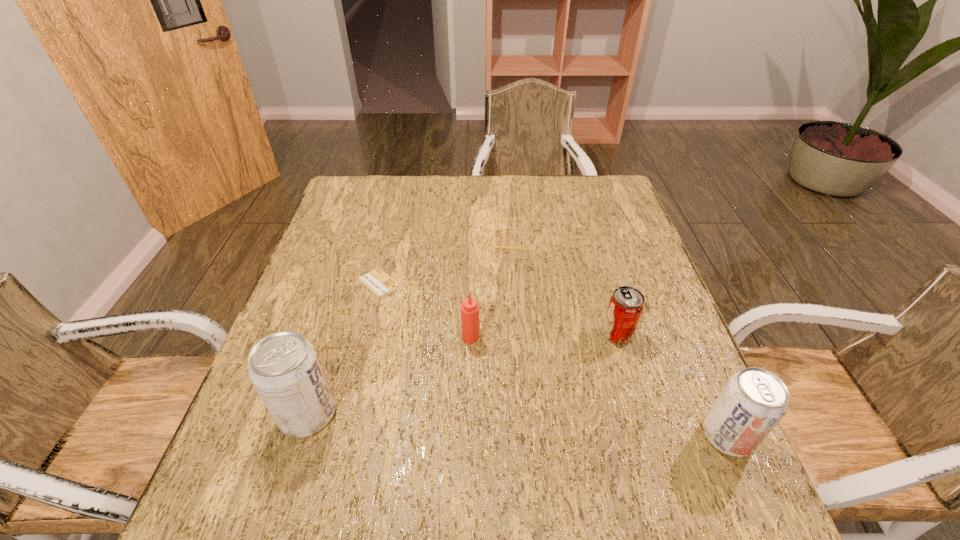
You are a GUI agent. You are given a task and a screenshot of the screen. Output one action in this format:
    pyautogui.click(x=<x>, y=<y>)
    Task: Click on the third shortest object
    The width and height of the screenshot is (960, 540).
    Given the screenshot: What is the action you would take?
    (626, 304)

The image size is (960, 540). I want to click on free spot located on the right of the leftmost pop soda, so click(x=498, y=414).

The width and height of the screenshot is (960, 540). I want to click on vacant space located on the left of the rightmost pop soda, so click(492, 435).

Where is `vacant space located 0.120m in front of the lenses of the spectacles`? The image size is (960, 540). vacant space located 0.120m in front of the lenses of the spectacles is located at coordinates (450, 243).

The image size is (960, 540). What are the coordinates of `vacant space situated 0.330m in front of the lenses of the spectacles` in the screenshot? It's located at (377, 243).

Identify the location of free space located 0.230m in front of the lenses of the spectacles. This screenshot has height=540, width=960. (412, 243).

Find the location of a particular element. The height and width of the screenshot is (540, 960). vacant area situated 0.350m on the right of the fourth object from right to left is located at coordinates (632, 337).

The height and width of the screenshot is (540, 960). What are the coordinates of `vacant space located on the front of the identity card` in the screenshot? It's located at (353, 386).

The height and width of the screenshot is (540, 960). I want to click on free spot located on the back of the shortest pop soda, so click(x=595, y=256).

At what (x,y) coordinates should I click in order to perform the action: click on soda can located in the left edge section of the desktop. Please return your answer as a coordinate pair (x, y). This screenshot has height=540, width=960. Looking at the image, I should click on (x=284, y=368).